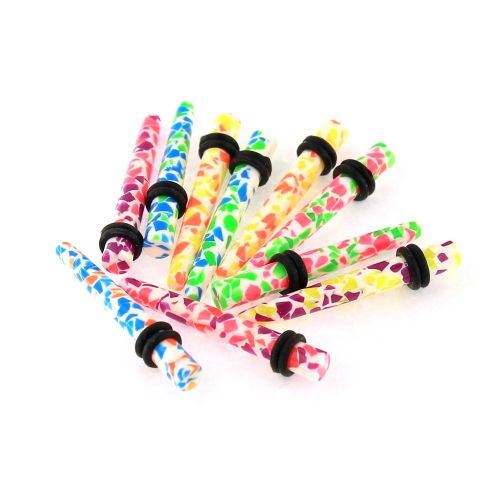
Find the location of a particular element. green and pink plug is located at coordinates (319, 213), (326, 259).